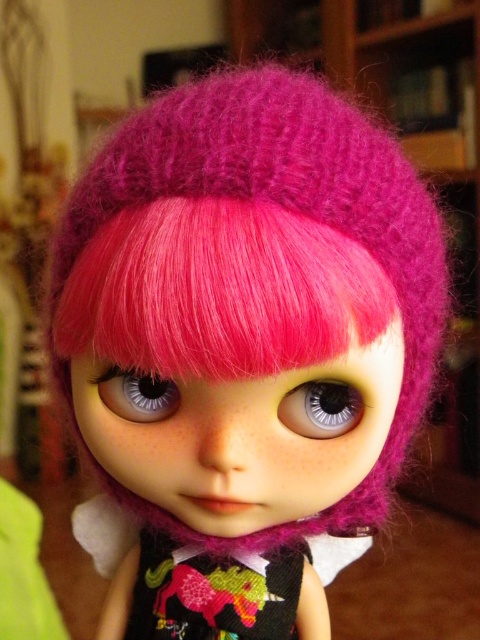
You are a photographer adjusting the focus on your camera. You notice two points on the doll, one at point (x=356, y=419) and another at point (x=124, y=392). Which point should you focus on to ensure it appears sharp in the photo?

You should focus on point (x=356, y=419) because it is closer to the camera and will appear sharper in the photo than the other point.

The doll has two eyes. One is a satin silver eye at center and the other is a satin blue eye at center. Which eye is positioned lower on the doll?

The satin silver eye at center is located below the satin blue eye at center, so the satin silver eye at center is positioned lower on the doll.